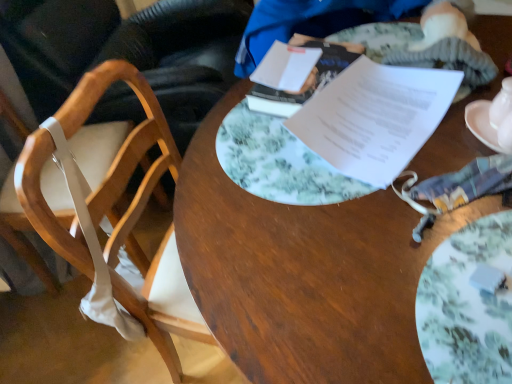
Question: From a real-world perspective, is wooden chair at left, placed as the second chair when sorted from right to left, on top of white paper at center, which is the second journal from back to front?

Choices:
 (A) yes
 (B) no

Answer: (B)

Question: Can you confirm if wooden chair at left, which is the 1th chair from left to right, is shorter than white paper at center, which is the second journal from back to front?

Choices:
 (A) yes
 (B) no

Answer: (B)

Question: Is wooden chair at left, which is the 1th chair from left to right, positioned before white paper at center, which is the second journal from back to front?

Choices:
 (A) yes
 (B) no

Answer: (B)

Question: Does wooden chair at left, which is the 1th chair from left to right, contain white paper at center, which is the second journal from back to front?

Choices:
 (A) yes
 (B) no

Answer: (B)

Question: From the image's perspective, does wooden chair at left, placed as the second chair when sorted from right to left, appear higher than white paper at center, which is the second journal from back to front?

Choices:
 (A) yes
 (B) no

Answer: (B)

Question: Is white glossy teapot at upper right spatially inside white ceramic saucer at right, or outside of it?

Choices:
 (A) outside
 (B) inside

Answer: (B)

Question: Considering the positions of white glossy teapot at upper right and white ceramic saucer at right in the image, is white glossy teapot at upper right bigger or smaller than white ceramic saucer at right?

Choices:
 (A) big
 (B) small

Answer: (B)

Question: From the image's perspective, is white glossy teapot at upper right positioned above or below white ceramic saucer at right?

Choices:
 (A) above
 (B) below

Answer: (A)

Question: From a real-world perspective, is white glossy teapot at upper right physically located above or below white ceramic saucer at right?

Choices:
 (A) below
 (B) above

Answer: (B)

Question: Based on their sizes in the image, would you say wooden desk at center is bigger or smaller than white paper at upper center, marked as the 1th journal in a back-to-front arrangement?

Choices:
 (A) big
 (B) small

Answer: (A)

Question: Is wooden desk at center in front of or behind white paper at upper center, marked as the 1th journal in a back-to-front arrangement, in the image?

Choices:
 (A) behind
 (B) front

Answer: (B)

Question: From the image's perspective, is wooden desk at center above or below white paper at upper center, marked as the 1th journal in a back-to-front arrangement?

Choices:
 (A) above
 (B) below

Answer: (B)

Question: From a real-world perspective, relative to white paper at upper center, marked as the 1th journal in a back-to-front arrangement, is wooden desk at center vertically above or below?

Choices:
 (A) above
 (B) below

Answer: (B)

Question: From their relative heights in the image, would you say porcelain floral plate at center is taller or shorter than wooden desk at center?

Choices:
 (A) short
 (B) tall

Answer: (A)

Question: Does point (501, 337) appear closer or farther from the camera than point (430, 231)?

Choices:
 (A) farther
 (B) closer

Answer: (B)